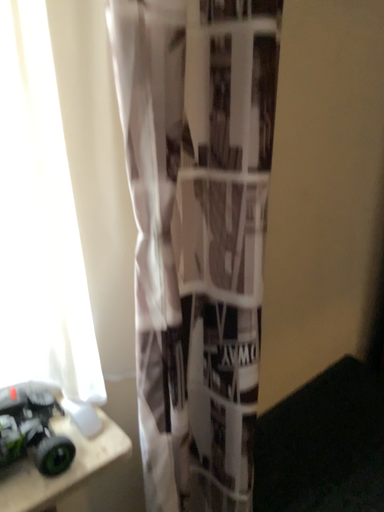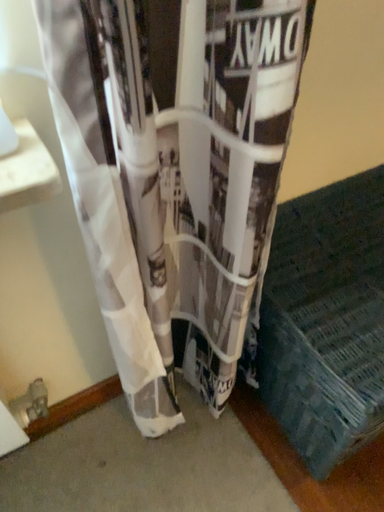
Question: How did the camera likely rotate when shooting the video?

Choices:
 (A) rotated upward
 (B) rotated downward

Answer: (B)